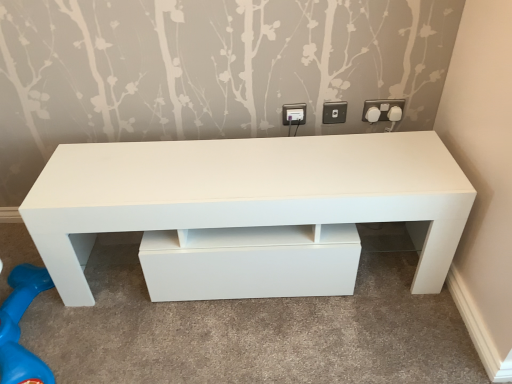
What are the coordinates of `white plastic socket at upper right, the second electric outlet viewed from the left` in the screenshot? It's located at (334, 112).

Identify the location of white plastic electric outlet at upper center, the 1th electric outlet viewed from the left. Image resolution: width=512 pixels, height=384 pixels. (294, 114).

How much space does white plastic electric outlet at upper center, the 3th electric outlet viewed from the right, occupy vertically?

white plastic electric outlet at upper center, the 3th electric outlet viewed from the right, is 3.45 inches in height.

Describe the element at coordinates (248, 192) in the screenshot. This screenshot has width=512, height=384. I see `white glossy table at center` at that location.

Locate an element on the screen. The height and width of the screenshot is (384, 512). white plastic socket at upper right, the second electric outlet viewed from the left is located at coordinates (334, 112).

Could you tell me if white plastic socket at upper right, acting as the first electric outlet starting from the right, is facing white plastic knob at upper right, the first knob from the right?

Yes, white plastic socket at upper right, acting as the first electric outlet starting from the right, is aimed at white plastic knob at upper right, the first knob from the right.

From a real-world perspective, is white plastic socket at upper right, which is the 3th electric outlet in left-to-right order, physically below white plastic knob at upper right, the second knob when ordered from left to right?

Incorrect, from a real-world perspective, white plastic socket at upper right, which is the 3th electric outlet in left-to-right order, is higher than white plastic knob at upper right, the second knob when ordered from left to right.

Locate an element on the screen. knob that is the 1st one when counting downward from the white plastic socket at upper right, acting as the first electric outlet starting from the right (from the image's perspective) is located at coordinates (394, 114).

How many degrees apart are the facing directions of white plastic socket at upper right, acting as the first electric outlet starting from the right, and white plastic knob at upper right, the second knob when ordered from left to right?

The angle between the facing direction of white plastic socket at upper right, acting as the first electric outlet starting from the right, and the facing direction of white plastic knob at upper right, the second knob when ordered from left to right, is 0.00457 degrees.

How different are the orientations of white plastic knob at upper right, the second knob when ordered from left to right, and white plastic electric outlet at upper center, the 1th electric outlet viewed from the left, in degrees?

0.0072 degrees.

Could you tell me if white plastic knob at upper right, the first knob from the right, is turned towards white plastic electric outlet at upper center, the 1th electric outlet viewed from the left?

No, white plastic knob at upper right, the first knob from the right, is not oriented towards white plastic electric outlet at upper center, the 1th electric outlet viewed from the left.

Are white plastic knob at upper right, the second knob when ordered from left to right, and white plastic electric outlet at upper center, the 3th electric outlet viewed from the right, located far from each other?

white plastic knob at upper right, the second knob when ordered from left to right, is actually quite close to white plastic electric outlet at upper center, the 3th electric outlet viewed from the right.

Considering their positions, is white plastic knob at upper right, the 2th knob when ordered from right to left, located in front of or behind white plastic electric outlet at upper center, the 3th electric outlet viewed from the right?

Clearly, white plastic knob at upper right, the 2th knob when ordered from right to left, is in front of white plastic electric outlet at upper center, the 3th electric outlet viewed from the right.

Is white plastic knob at upper right, which appears as the first knob when viewed from the left, facing away from white plastic electric outlet at upper center, the 3th electric outlet viewed from the right?

No, white plastic knob at upper right, which appears as the first knob when viewed from the left, is not facing away from white plastic electric outlet at upper center, the 3th electric outlet viewed from the right.

Which is less distant, [369,113] or [289,122]?

Point [369,113].

Considering the sizes of white plastic knob at upper right, which appears as the first knob when viewed from the left, and white plastic electric outlet at upper center, the 1th electric outlet viewed from the left, in the image, is white plastic knob at upper right, which appears as the first knob when viewed from the left, wider or thinner than white plastic electric outlet at upper center, the 1th electric outlet viewed from the left,?

In the image, white plastic knob at upper right, which appears as the first knob when viewed from the left, appears to be wider than white plastic electric outlet at upper center, the 1th electric outlet viewed from the left.

Can you confirm if white plastic socket at upper right, the second electric outlet viewed from the left, is taller than white plastic electric outlet at upper center, the 1th electric outlet viewed from the left?

No, white plastic socket at upper right, the second electric outlet viewed from the left, is not taller than white plastic electric outlet at upper center, the 1th electric outlet viewed from the left.

Which object is further away from the camera taking this photo, white plastic socket at upper right, placed as the 2th electric outlet when sorted from right to left, or white plastic electric outlet at upper center, the 1th electric outlet viewed from the left?

white plastic electric outlet at upper center, the 1th electric outlet viewed from the left, is further away from the camera.

What's the angular difference between white plastic socket at upper right, the second electric outlet viewed from the left, and white plastic electric outlet at upper center, the 3th electric outlet viewed from the right,'s facing directions?

0.0142 degrees separate the facing orientations of white plastic socket at upper right, the second electric outlet viewed from the left, and white plastic electric outlet at upper center, the 3th electric outlet viewed from the right.

Measure the distance from white plastic socket at upper right, placed as the 2th electric outlet when sorted from right to left, to white plastic electric outlet at upper center, the 1th electric outlet viewed from the left.

white plastic socket at upper right, placed as the 2th electric outlet when sorted from right to left, is 4.51 inches away from white plastic electric outlet at upper center, the 1th electric outlet viewed from the left.

From the image's perspective, count 1st knobs upward from the white glossy table at center and point to it. Please provide its 2D coordinates.

[(372, 114)]

Visually, is white plastic knob at upper right, the 2th knob when ordered from right to left, positioned to the left or to the right of white glossy table at center?

Clearly, white plastic knob at upper right, the 2th knob when ordered from right to left, is on the right of white glossy table at center in the image.

Based on the photo, is white plastic knob at upper right, the 2th knob when ordered from right to left, located outside white glossy table at center?

Yes.

Which of these two, white plastic knob at upper right, which appears as the first knob when viewed from the left, or white glossy table at center, is thinner?

With smaller width is white plastic knob at upper right, which appears as the first knob when viewed from the left.

Does white plastic socket at upper right, placed as the 2th electric outlet when sorted from right to left, have a lesser height compared to white plastic socket at upper right, acting as the first electric outlet starting from the right?

Indeed, white plastic socket at upper right, placed as the 2th electric outlet when sorted from right to left, has a lesser height compared to white plastic socket at upper right, acting as the first electric outlet starting from the right.

From a real-world perspective, who is located higher, white plastic socket at upper right, the second electric outlet viewed from the left, or white plastic socket at upper right, acting as the first electric outlet starting from the right?

From a 3D spatial view, white plastic socket at upper right, acting as the first electric outlet starting from the right, is above.

Is white plastic socket at upper right, placed as the 2th electric outlet when sorted from right to left, oriented away from white plastic socket at upper right, which is the 3th electric outlet in left-to-right order?

No, white plastic socket at upper right, placed as the 2th electric outlet when sorted from right to left,'s orientation is not away from white plastic socket at upper right, which is the 3th electric outlet in left-to-right order.

What's the angular difference between white plastic socket at upper right, the second electric outlet viewed from the left, and white plastic socket at upper right, acting as the first electric outlet starting from the right,'s facing directions?

The facing directions of white plastic socket at upper right, the second electric outlet viewed from the left, and white plastic socket at upper right, acting as the first electric outlet starting from the right, are 0.00249 degrees apart.

Between white plastic electric outlet at upper center, the 1th electric outlet viewed from the left, and white glossy table at center, which one appears on the right side from the viewer's perspective?

Positioned to the right is white plastic electric outlet at upper center, the 1th electric outlet viewed from the left.

Is white glossy table at center surrounded by white plastic electric outlet at upper center, the 3th electric outlet viewed from the right?

Actually, white glossy table at center is outside white plastic electric outlet at upper center, the 3th electric outlet viewed from the right.

Is white plastic electric outlet at upper center, the 3th electric outlet viewed from the right, positioned behind white glossy table at center?

Yes, it is behind white glossy table at center.

Is white glossy table at center at the back of white plastic electric outlet at upper center, the 1th electric outlet viewed from the left?

That's not correct — white plastic electric outlet at upper center, the 1th electric outlet viewed from the left, is not looking away from white glossy table at center.

In order to click on knob behind the white plastic socket at upper right, which is the 3th electric outlet in left-to-right order in this screenshot , I will do `click(394, 114)`.

I want to click on the 2nd knob to the right of the white plastic electric outlet at upper center, the 3th electric outlet viewed from the right, starting your count from the anchor, so click(394, 114).

Based on their spatial positions, is white plastic socket at upper right, acting as the first electric outlet starting from the right, or white plastic knob at upper right, the first knob from the right, closer to white plastic socket at upper right, placed as the 2th electric outlet when sorted from right to left?

Based on the image, white plastic socket at upper right, acting as the first electric outlet starting from the right, appears to be nearer to white plastic socket at upper right, placed as the 2th electric outlet when sorted from right to left.

When comparing their distances from white plastic socket at upper right, placed as the 2th electric outlet when sorted from right to left, does white glossy table at center or white plastic knob at upper right, the first knob from the right, seem further?

The object further to white plastic socket at upper right, placed as the 2th electric outlet when sorted from right to left, is white glossy table at center.

Based on their spatial positions, is white plastic electric outlet at upper center, the 1th electric outlet viewed from the left, or white plastic knob at upper right, the first knob from the right, closer to white plastic socket at upper right, placed as the 2th electric outlet when sorted from right to left?

white plastic electric outlet at upper center, the 1th electric outlet viewed from the left.

Based on their spatial positions, is white plastic knob at upper right, the first knob from the right, or white glossy table at center further from white plastic socket at upper right, which is the 3th electric outlet in left-to-right order?

The object further to white plastic socket at upper right, which is the 3th electric outlet in left-to-right order, is white glossy table at center.

When comparing their distances from white plastic knob at upper right, the 2th knob when ordered from right to left, does white glossy table at center or white plastic socket at upper right, placed as the 2th electric outlet when sorted from right to left, seem further?

Among the two, white glossy table at center is located further to white plastic knob at upper right, the 2th knob when ordered from right to left.

Considering their positions, is white plastic knob at upper right, the 2th knob when ordered from right to left, positioned closer to white plastic socket at upper right, the second electric outlet viewed from the left, than white glossy table at center?

The object closer to white plastic socket at upper right, the second electric outlet viewed from the left, is white plastic knob at upper right, the 2th knob when ordered from right to left.

Which object lies further to the anchor point white glossy table at center, white plastic socket at upper right, acting as the first electric outlet starting from the right, or white plastic knob at upper right, the 2th knob when ordered from right to left?

Among the two, white plastic knob at upper right, the 2th knob when ordered from right to left, is located further to white glossy table at center.

Which object lies nearer to the anchor point white plastic knob at upper right, the first knob from the right, white plastic knob at upper right, which appears as the first knob when viewed from the left, or white glossy table at center?

Based on the image, white plastic knob at upper right, which appears as the first knob when viewed from the left, appears to be nearer to white plastic knob at upper right, the first knob from the right.

The height and width of the screenshot is (384, 512). Identify the location of electric outlet between white plastic socket at upper right, the second electric outlet viewed from the left, and white glossy table at center vertically. (294, 114).

Where is `knob located between white plastic socket at upper right, placed as the 2th electric outlet when sorted from right to left, and white plastic socket at upper right, acting as the first electric outlet starting from the right, in the left-right direction`? knob located between white plastic socket at upper right, placed as the 2th electric outlet when sorted from right to left, and white plastic socket at upper right, acting as the first electric outlet starting from the right, in the left-right direction is located at coordinates (372, 114).

This screenshot has width=512, height=384. Find the location of `knob between white plastic electric outlet at upper center, the 3th electric outlet viewed from the right, and white plastic socket at upper right, acting as the first electric outlet starting from the right, from left to right`. knob between white plastic electric outlet at upper center, the 3th electric outlet viewed from the right, and white plastic socket at upper right, acting as the first electric outlet starting from the right, from left to right is located at coordinates (372, 114).

The width and height of the screenshot is (512, 384). I want to click on electric outlet located between white plastic electric outlet at upper center, the 1th electric outlet viewed from the left, and white plastic knob at upper right, which appears as the first knob when viewed from the left, in the left-right direction, so point(334,112).